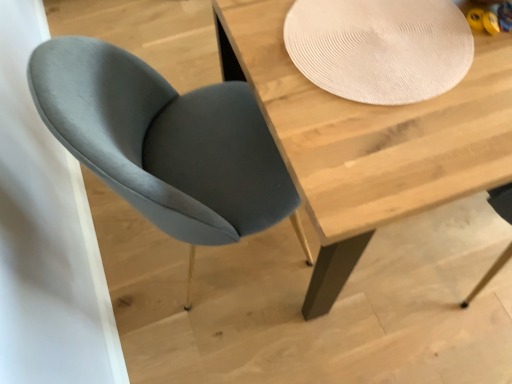
The image size is (512, 384). What are the coordinates of `unoccupied area in front of velvet grey chair at left` in the screenshot? It's located at (232, 339).